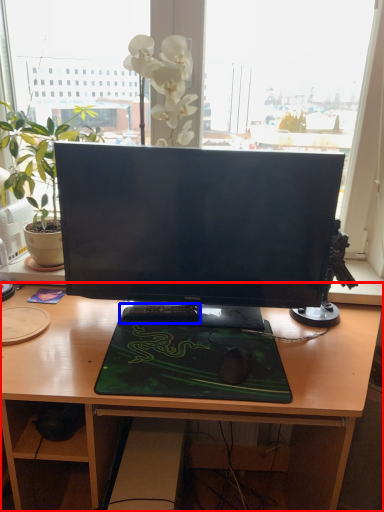
Question: Among these objects, which one is farthest to the camera, desk (highlighted by a red box) or laptop keyboard (highlighted by a blue box)?

Choices:
 (A) desk
 (B) laptop keyboard

Answer: (B)